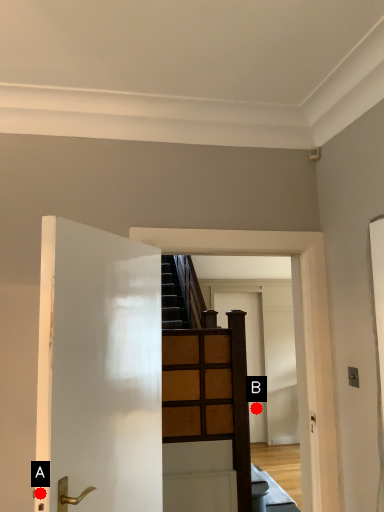
Question: Two points are circled on the image, labeled by A and B beside each circle. Among these points, which one is farthest from the camera?

Choices:
 (A) A is further
 (B) B is further

Answer: (B)